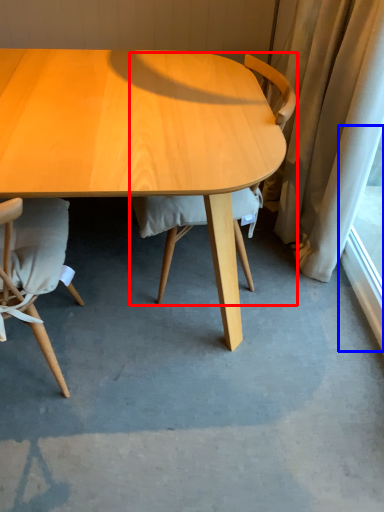
Question: Which point is further to the camera, chair (highlighted by a red box) or window screen (highlighted by a blue box)?

Choices:
 (A) chair
 (B) window screen

Answer: (B)